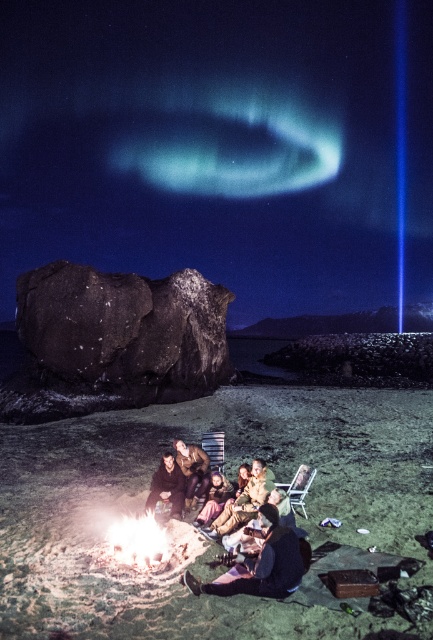
Question: Which point is farther from the camera taking this photo?

Choices:
 (A) (291, 541)
 (B) (132, 529)
 (C) (190, 464)

Answer: (C)

Question: In this image, where is smooth brown leather jacket at center located relative to brown leather jacket at center?

Choices:
 (A) above
 (B) below

Answer: (A)

Question: Estimate the real-world distances between objects in this image. Which object is closer to the brown leather jacket at center?

Choices:
 (A) metallic silver chair at lower center
 (B) wooden textured chair at lower center
 (C) light brown leather jacket at center

Answer: (C)

Question: Does brown leather jacket at lower center have a smaller size compared to brown leather jacket at center?

Choices:
 (A) no
 (B) yes

Answer: (A)

Question: Which object is the farthest from the dark matte rock at center?

Choices:
 (A) light brown leather jacket at center
 (B) smooth sand beach at center
 (C) wooden textured chair at lower center
 (D) flaming wood fire at lower center

Answer: (D)

Question: Is smooth sand beach at center below light brown leather jacket at center?

Choices:
 (A) yes
 (B) no

Answer: (A)